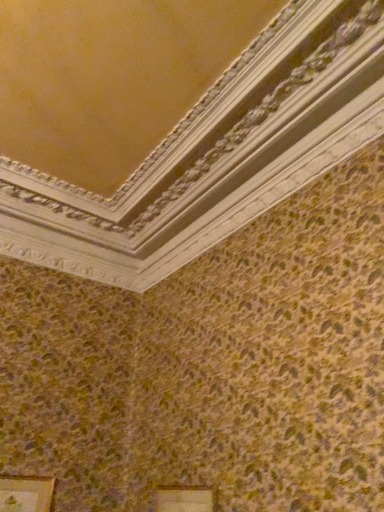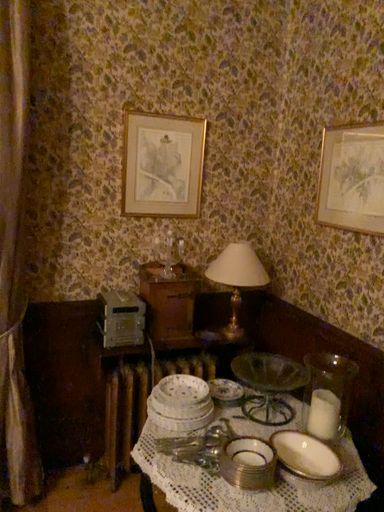
Question: Which way did the camera rotate in the video?

Choices:
 (A) rotated upward
 (B) rotated downward

Answer: (B)